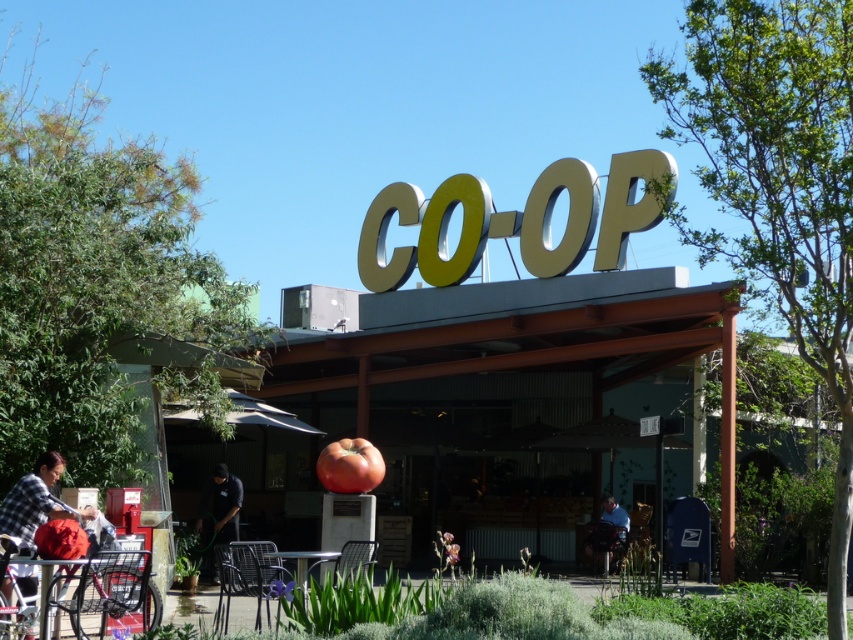
Question: Among these objects, which one is farthest from the camera?

Choices:
 (A) plaid fabric shirt at lower left
 (B) metallic silver table at center
 (C) light blue shirt at center

Answer: (C)

Question: Does transparent fabric canopy at center have a smaller size compared to light blue shirt at center?

Choices:
 (A) yes
 (B) no

Answer: (B)

Question: Is plaid fabric shirt at lower left bigger than light blue shirt at center?

Choices:
 (A) yes
 (B) no

Answer: (B)

Question: From the image, what is the correct spatial relationship of metallic gold sign at center in relation to transparent fabric canopy at center?

Choices:
 (A) left
 (B) right

Answer: (B)

Question: Which object is the farthest from the metallic gold sign at center?

Choices:
 (A) black smooth shirt at lower center
 (B) plaid fabric shirt at lower left
 (C) transparent fabric canopy at center
 (D) light blue shirt at center

Answer: (B)

Question: Among these objects, which one is nearest to the camera?

Choices:
 (A) metallic gold sign at center
 (B) black smooth shirt at lower center
 (C) transparent fabric canopy at center
 (D) light blue shirt at center

Answer: (C)